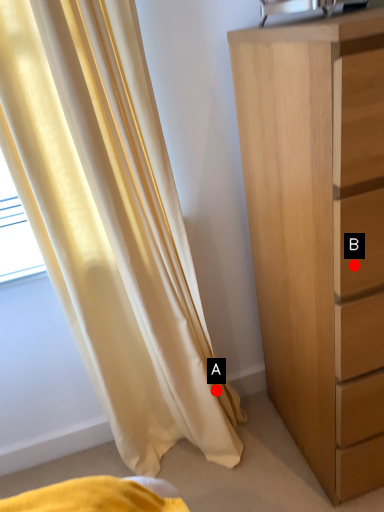
Question: Two points are circled on the image, labeled by A and B beside each circle. Which point is closer to the camera taking this photo?

Choices:
 (A) A is closer
 (B) B is closer

Answer: (B)